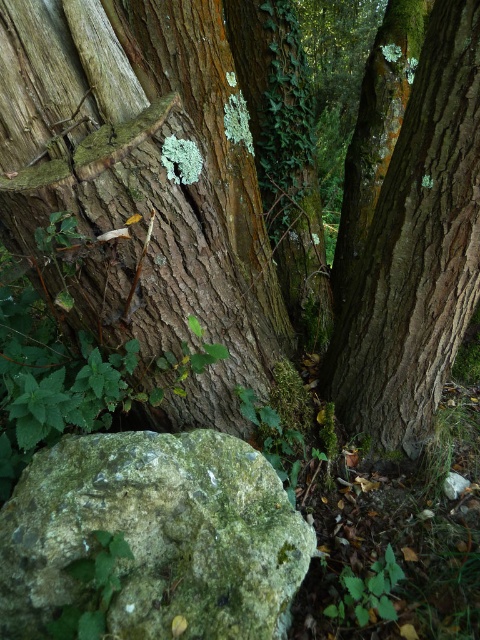
You are standing in the natural scene described. You need to locate the rough bark tree at center. What are the coordinates of its position in the image?

The rough bark tree at center is located at coordinates (165, 168).